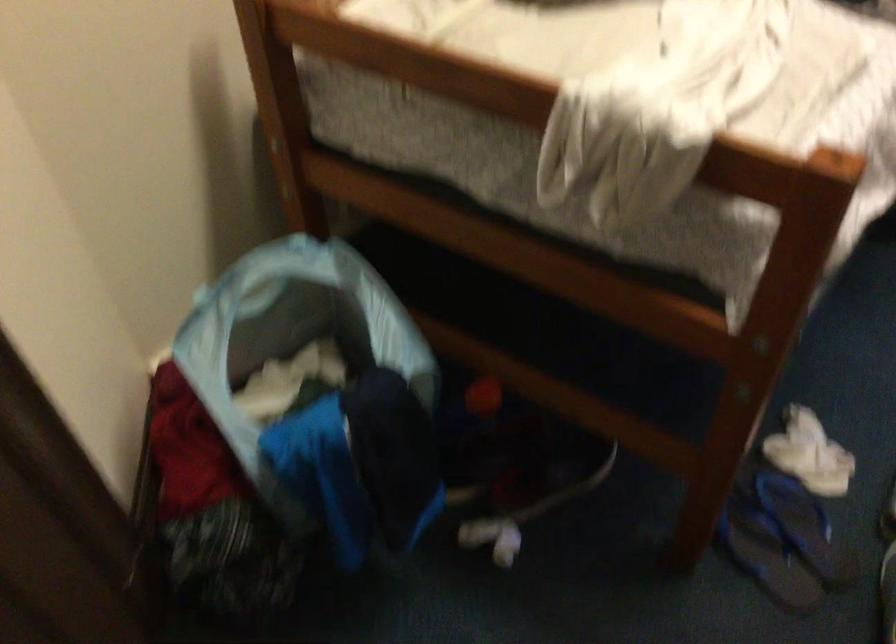
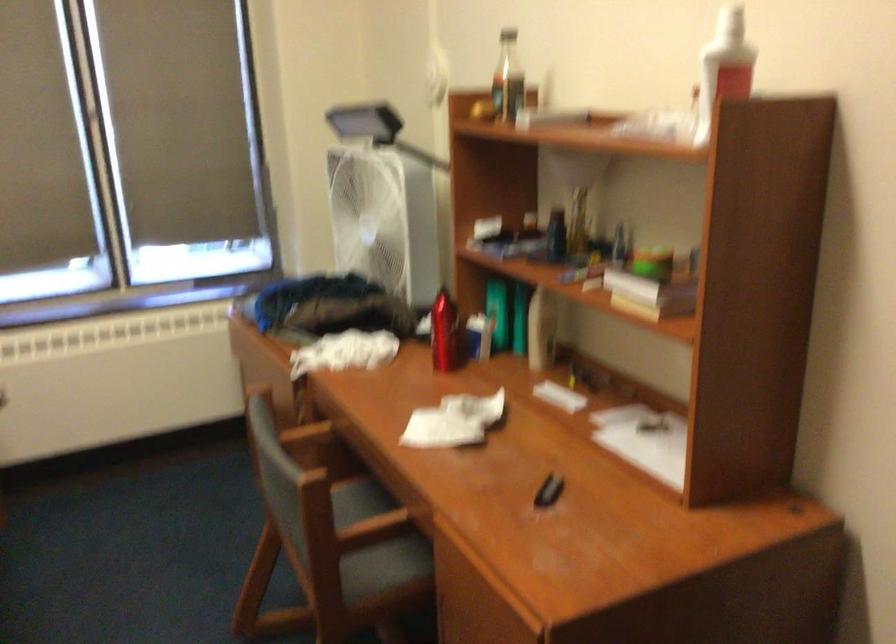
Question: The camera is either moving clockwise (left) or counter-clockwise (right) around the object. The first image is from the beginning of the video and the second image is from the end. Is the camera moving left or right when shooting the video?

Choices:
 (A) Left
 (B) Right

Answer: (A)